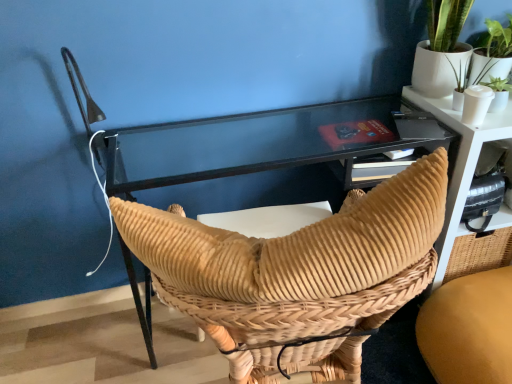
Question: Which direction should I rotate to look at woven tan chair at center, which is the 2th chair in right-to-left order?

Choices:
 (A) right
 (B) left

Answer: (A)

Question: Does brown woven chair at center, marked as the first chair in a right-to-left arrangement, have a greater height compared to woven tan chair at center, marked as the 1th chair in a left-to-right arrangement?

Choices:
 (A) no
 (B) yes

Answer: (A)

Question: From a real-world perspective, is brown woven chair at center, marked as the first chair in a right-to-left arrangement, positioned over woven tan chair at center, which is the 2th chair in right-to-left order, based on gravity?

Choices:
 (A) no
 (B) yes

Answer: (A)

Question: Is brown woven chair at center, the second chair in the left-to-right sequence, far away from woven tan chair at center, marked as the 1th chair in a left-to-right arrangement?

Choices:
 (A) no
 (B) yes

Answer: (A)

Question: Is brown woven chair at center, the second chair in the left-to-right sequence, oriented away from woven tan chair at center, marked as the 1th chair in a left-to-right arrangement?

Choices:
 (A) yes
 (B) no

Answer: (B)

Question: Is brown woven chair at center, marked as the first chair in a right-to-left arrangement, bigger than woven tan chair at center, which is the 2th chair in right-to-left order?

Choices:
 (A) yes
 (B) no

Answer: (B)

Question: Can you confirm if brown woven chair at center, the second chair in the left-to-right sequence, is positioned to the right of woven tan chair at center, marked as the 1th chair in a left-to-right arrangement?

Choices:
 (A) no
 (B) yes

Answer: (B)

Question: Could you tell me if woven tan chair at center, which is the 2th chair in right-to-left order, is turned towards matte black table at upper right?

Choices:
 (A) yes
 (B) no

Answer: (B)

Question: From a real-world perspective, is woven tan chair at center, marked as the 1th chair in a left-to-right arrangement, located higher than matte black table at upper right?

Choices:
 (A) yes
 (B) no

Answer: (A)

Question: From the image's perspective, is woven tan chair at center, marked as the 1th chair in a left-to-right arrangement, located above matte black table at upper right?

Choices:
 (A) no
 (B) yes

Answer: (A)

Question: Is woven tan chair at center, which is the 2th chair in right-to-left order, not near matte black table at upper right?

Choices:
 (A) yes
 (B) no

Answer: (B)

Question: Is woven tan chair at center, marked as the 1th chair in a left-to-right arrangement, thinner than matte black table at upper right?

Choices:
 (A) no
 (B) yes

Answer: (A)

Question: Is woven tan chair at center, which is the 2th chair in right-to-left order, at the right side of matte black table at upper right?

Choices:
 (A) no
 (B) yes

Answer: (A)

Question: From the image's perspective, is brown woven chair at center, the second chair in the left-to-right sequence, over matte black table at upper right?

Choices:
 (A) no
 (B) yes

Answer: (A)